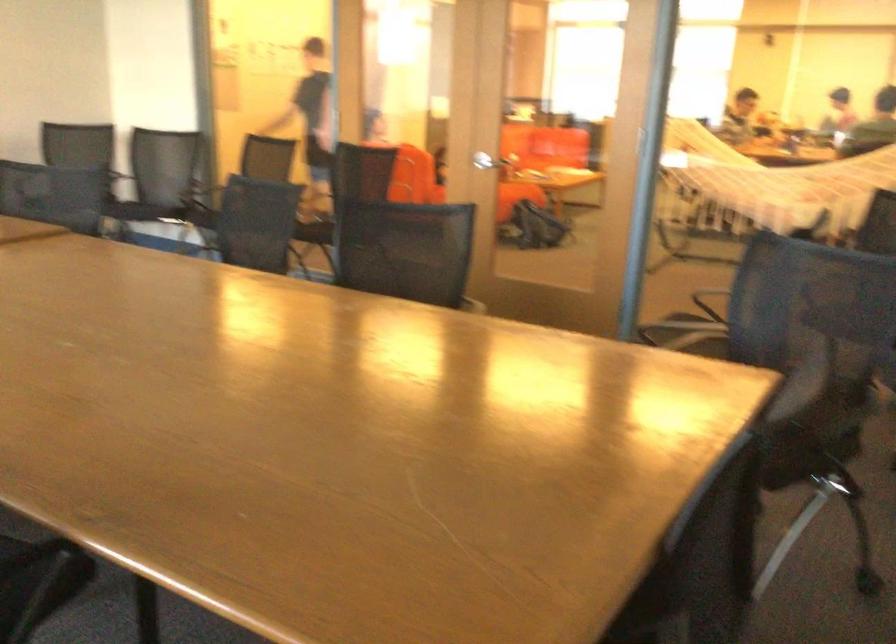
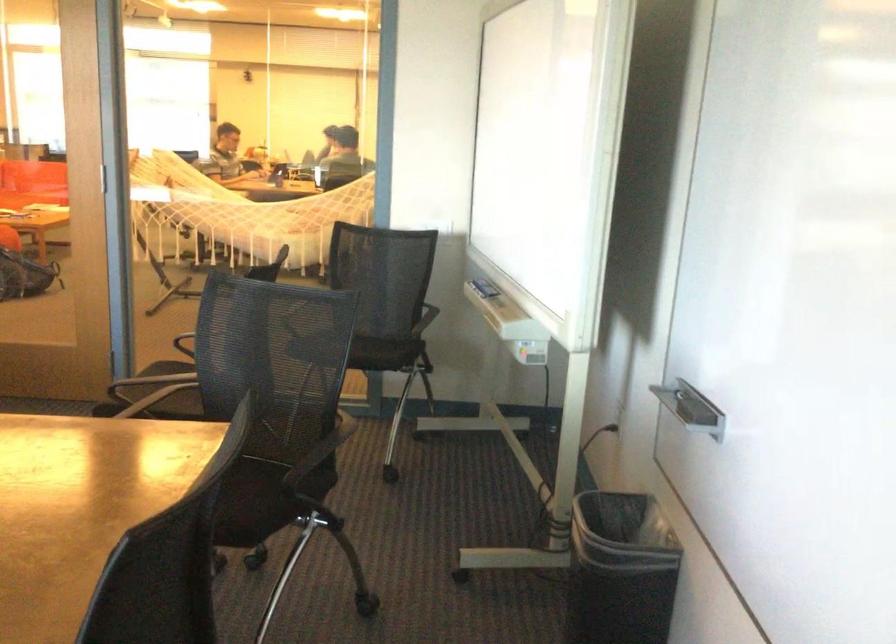
Question: The first image is from the beginning of the video and the second image is from the end. How did the camera likely rotate when shooting the video?

Choices:
 (A) Left
 (B) Right
 (C) Up
 (D) Down

Answer: (B)